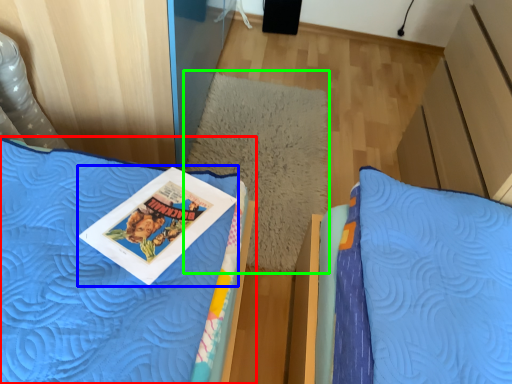
Question: Which object is positioned farthest from bed (highlighted by a red box)? Select from comic book (highlighted by a blue box) and pillow (highlighted by a green box).

Choices:
 (A) comic book
 (B) pillow

Answer: (B)